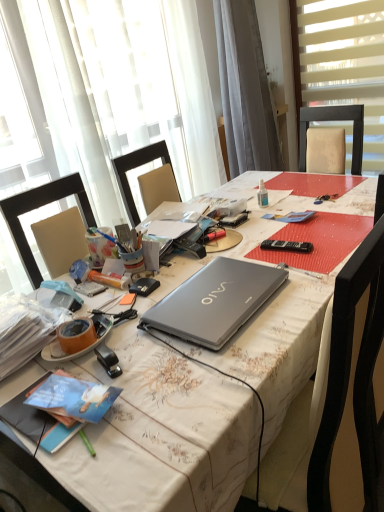
At what (x,y) coordinates should I click in order to perform the action: click on free space above metallic silver laptop at center (from a real-world perspective). Please return your answer as a coordinate pair (x, y). This screenshot has height=512, width=384. Looking at the image, I should click on (200, 259).